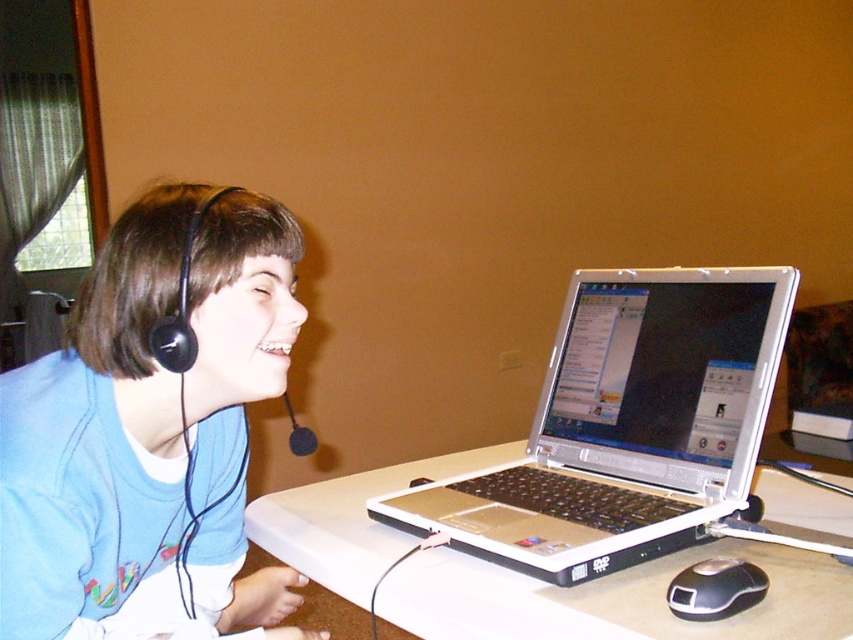
You are a delivery robot with a package that needs to be placed between the matte blue shirt at left and the black matte microphone at left. The package is 10 inches wide. Can you fit it there?

The distance between the matte blue shirt at left and the black matte microphone at left is 8.26 inches, which is narrower than the package width of 10 inches. Therefore, the package cannot fit in that space.

You are setting up a microphone stand for a live stream. The white plastic table at center and the black matte microphone at left are in your way. Which object should you move to make space?

You should move the black matte microphone at left because the white plastic table at center is below it, so moving the microphone will free up space above the table.